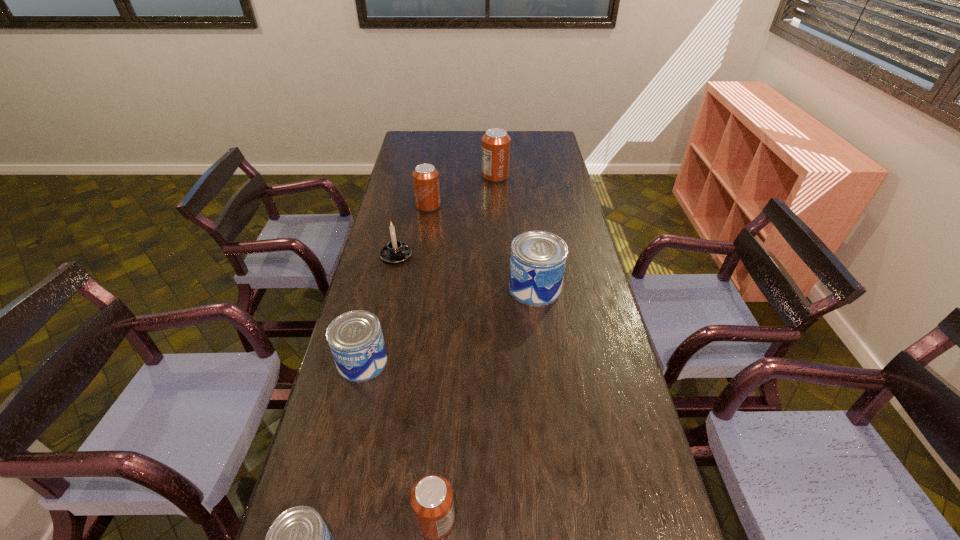
Find the location of `the tallest can`. the tallest can is located at coordinates (496, 142).

The width and height of the screenshot is (960, 540). What are the coordinates of `the farthest orange can` in the screenshot? It's located at (496, 142).

The height and width of the screenshot is (540, 960). In order to click on the third smallest orange can in this screenshot , I will do `click(425, 177)`.

Where is `the second farthest object`? the second farthest object is located at coordinates (425, 177).

Locate an element on the screen. Image resolution: width=960 pixels, height=540 pixels. the biggest blue can is located at coordinates (537, 263).

This screenshot has height=540, width=960. What are the coordinates of `the fifth nearest can` in the screenshot? It's located at (537, 263).

Identify the location of candle holder. (395, 251).

Find the location of a particular element. The width and height of the screenshot is (960, 540). the fourth nearest can is located at coordinates (355, 338).

Locate an element on the screen. the fifth farthest object is located at coordinates (355, 338).

At what (x,y) coordinates should I click in order to perform the action: click on free location located on the front of the tallest object. Please return your answer as a coordinate pair (x, y). Looking at the image, I should click on (497, 215).